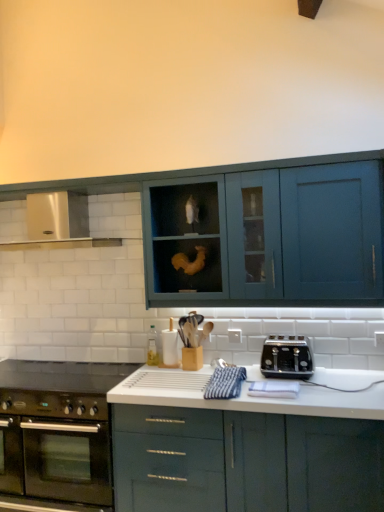
Question: Which direction should I rotate to face white glossy countertop at center, which is the 1th cabinetry in bottom-to-top order, — up or down?

Choices:
 (A) up
 (B) down

Answer: (B)

Question: Would you say black glass gas stove at lower left contains white glossy countertop at center, the second cabinetry in the top-to-bottom sequence?

Choices:
 (A) no
 (B) yes

Answer: (A)

Question: Is black glass gas stove at lower left to the left of white glossy countertop at center, the second cabinetry in the top-to-bottom sequence, from the viewer's perspective?

Choices:
 (A) yes
 (B) no

Answer: (A)

Question: From the image's perspective, is black glass gas stove at lower left above white glossy countertop at center, the second cabinetry in the top-to-bottom sequence?

Choices:
 (A) no
 (B) yes

Answer: (B)

Question: From a real-world perspective, is black glass gas stove at lower left under white glossy countertop at center, which is the 1th cabinetry in bottom-to-top order?

Choices:
 (A) no
 (B) yes

Answer: (A)

Question: Does black glass gas stove at lower left have a greater width compared to white glossy countertop at center, which is the 1th cabinetry in bottom-to-top order?

Choices:
 (A) yes
 (B) no

Answer: (B)

Question: From a real-world perspective, is black glass gas stove at lower left located higher than white glossy countertop at center, the second cabinetry in the top-to-bottom sequence?

Choices:
 (A) yes
 (B) no

Answer: (A)

Question: Considering the relative sizes of black glass gas stove at lower left and satin silver exhaust hood at upper left in the image provided, is black glass gas stove at lower left taller than satin silver exhaust hood at upper left?

Choices:
 (A) yes
 (B) no

Answer: (B)

Question: Is black glass gas stove at lower left next to satin silver exhaust hood at upper left?

Choices:
 (A) no
 (B) yes

Answer: (A)

Question: Does black glass gas stove at lower left have a lesser width compared to satin silver exhaust hood at upper left?

Choices:
 (A) yes
 (B) no

Answer: (B)

Question: Does black glass gas stove at lower left have a larger size compared to satin silver exhaust hood at upper left?

Choices:
 (A) no
 (B) yes

Answer: (A)

Question: From the image's perspective, is black glass gas stove at lower left on satin silver exhaust hood at upper left?

Choices:
 (A) no
 (B) yes

Answer: (A)

Question: Is there a large distance between black glass gas stove at lower left and satin silver exhaust hood at upper left?

Choices:
 (A) yes
 (B) no

Answer: (B)

Question: Does black glass gas stove at lower left have a greater width compared to stainless steel oven at lower left?

Choices:
 (A) yes
 (B) no

Answer: (B)